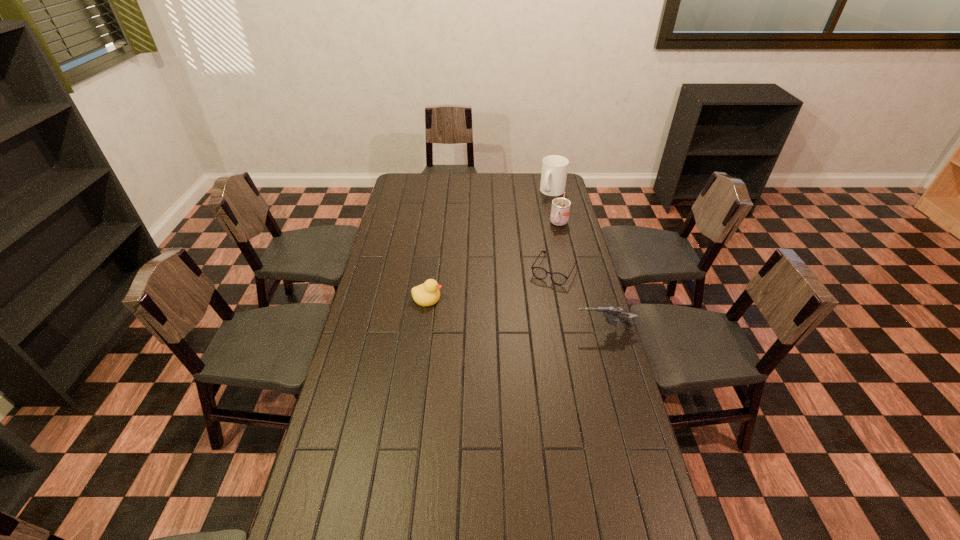
You are a GUI agent. You are given a task and a screenshot of the screen. Output one action in this format:
    pyautogui.click(x=<x>, y=<y>)
    Task: Click on the free space located on the handle side of the tallest object
    
    Given the screenshot: What is the action you would take?
    pyautogui.click(x=542, y=214)

Locate an element on the screen. The height and width of the screenshot is (540, 960). free space located 0.090m on the handle side of the tallest object is located at coordinates (545, 208).

The width and height of the screenshot is (960, 540). Identify the location of free space located on the handle side of the tallest object. (534, 229).

The width and height of the screenshot is (960, 540). Find the location of `object that is at the far edge`. object that is at the far edge is located at coordinates (554, 167).

I want to click on gun present at the right edge, so click(x=610, y=313).

The image size is (960, 540). I want to click on spectacles that is at the right edge, so click(x=540, y=273).

Image resolution: width=960 pixels, height=540 pixels. In order to click on cup present at the right edge in this screenshot , I will do `click(560, 209)`.

You are a GUI agent. You are given a task and a screenshot of the screen. Output one action in this format:
    pyautogui.click(x=<x>, y=<y>)
    Task: Click on the mug positioned at the right edge
    This screenshot has height=540, width=960.
    Given the screenshot: What is the action you would take?
    pyautogui.click(x=554, y=167)

Locate an element on the screen. This screenshot has height=540, width=960. object situated at the far right corner is located at coordinates (554, 167).

Locate an element on the screen. Image resolution: width=960 pixels, height=540 pixels. free location at the far edge is located at coordinates (485, 186).